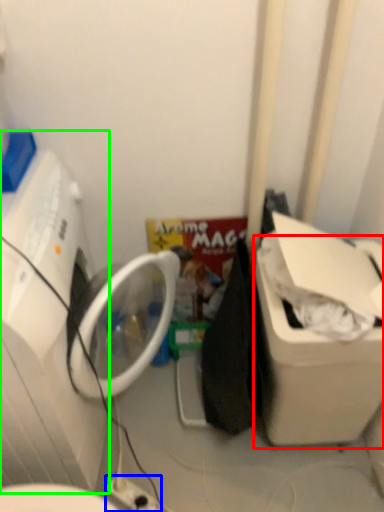
Question: Based on their relative distances, which object is nearer to water cooler (highlighted by a red box)? Choose from electric outlet (highlighted by a blue box) and washing machine (highlighted by a green box).

Choices:
 (A) electric outlet
 (B) washing machine

Answer: (A)